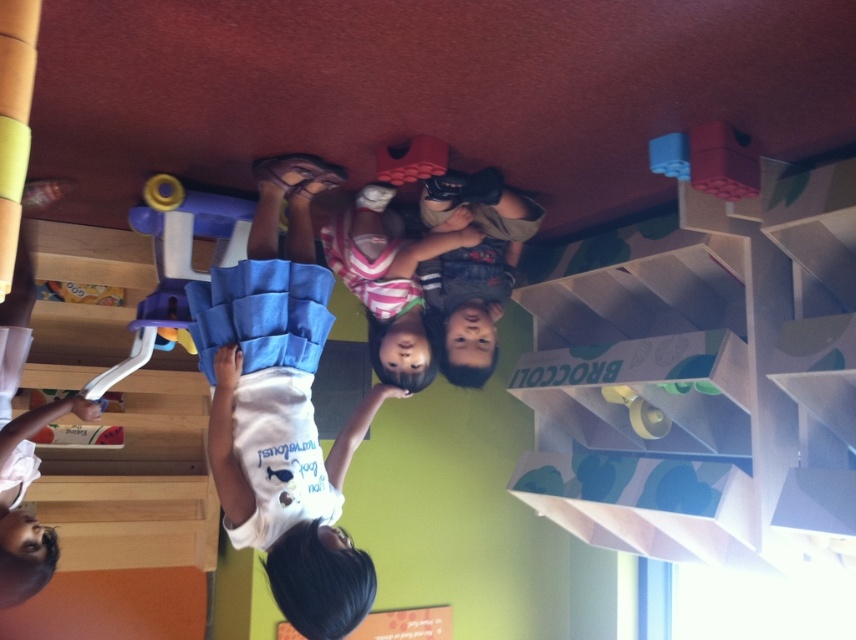
Question: Is the position of white cotton shirt at center less distant than that of striped fabric shirt at center?

Choices:
 (A) no
 (B) yes

Answer: (B)

Question: Does white cotton shirt at center lie in front of striped fabric shirt at center?

Choices:
 (A) no
 (B) yes

Answer: (B)

Question: Can you confirm if white cotton shirt at center is smaller than striped fabric shirt at center?

Choices:
 (A) no
 (B) yes

Answer: (A)